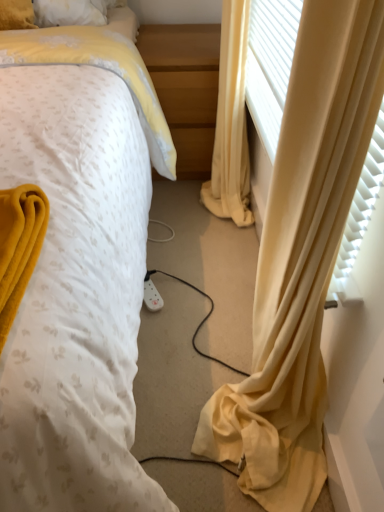
What do you see at coordinates (185, 88) in the screenshot?
I see `light wood/finely finished nightstand at center` at bounding box center [185, 88].

Where is `yellow fabric curtain at right`? This screenshot has width=384, height=512. yellow fabric curtain at right is located at coordinates click(x=231, y=122).

Is yellow fabric curtain at right to the right of white dotted fabric at center from the viewer's perspective?

Yes.

Can you confirm if yellow fabric curtain at right is taller than white dotted fabric at center?

Incorrect, the height of yellow fabric curtain at right is not larger of that of white dotted fabric at center.

Is yellow fabric curtain at right not inside white dotted fabric at center?

Indeed, yellow fabric curtain at right is completely outside white dotted fabric at center.

Locate an element on the screen. The height and width of the screenshot is (512, 384). bed on the left of yellow fabric curtain at right is located at coordinates (123, 22).

Considering their positions, is white dotted fabric at center located in front of or behind yellow fabric curtain at right?

Visually, white dotted fabric at center is located in front of yellow fabric curtain at right.

From a real-world perspective, which is physically below, white dotted fabric at center or yellow fabric curtain at right?

yellow fabric curtain at right, from a real-world perspective.

Would you say white dotted fabric at center is inside or outside yellow fabric curtain at right?

white dotted fabric at center exists outside the volume of yellow fabric curtain at right.

Between white dotted fabric at center and yellow fabric curtain at right, which one has larger size?

With larger size is white dotted fabric at center.

Is white dotted fabric at center outside of light wood/finely finished nightstand at center?

Yes, white dotted fabric at center is outside of light wood/finely finished nightstand at center.

From the image's perspective, would you say white dotted fabric at center is shown under light wood/finely finished nightstand at center?

Correct, white dotted fabric at center appears lower than light wood/finely finished nightstand at center in the image.

Is white dotted fabric at center taller or shorter than light wood/finely finished nightstand at center?

white dotted fabric at center is taller than light wood/finely finished nightstand at center.

Consider the image. Can you confirm if white dotted fabric at center is bigger than light wood/finely finished nightstand at center?

Correct, white dotted fabric at center is larger in size than light wood/finely finished nightstand at center.

Considering the positions of objects light wood/finely finished nightstand at center and white dotted fabric at center in the image provided, who is behind, light wood/finely finished nightstand at center or white dotted fabric at center?

light wood/finely finished nightstand at center is further from the camera.

The image size is (384, 512). What are the coordinates of `bed that is in front of the light wood/finely finished nightstand at center` in the screenshot? It's located at (123, 22).

Is point (210, 52) positioned behind point (122, 18)?

That is False.

Can you confirm if light wood/finely finished nightstand at center is positioned to the left of white dotted fabric at center?

In fact, light wood/finely finished nightstand at center is to the right of white dotted fabric at center.

In the image, is yellow fabric curtain at right positioned in front of or behind light wood/finely finished nightstand at center?

yellow fabric curtain at right is in front of light wood/finely finished nightstand at center.

Does yellow fabric curtain at right turn towards light wood/finely finished nightstand at center?

No.

From a real-world perspective, is yellow fabric curtain at right located beneath light wood/finely finished nightstand at center?

Incorrect, from a real-world perspective, yellow fabric curtain at right is higher than light wood/finely finished nightstand at center.

Is yellow fabric curtain at right at the right side of light wood/finely finished nightstand at center?

Yes, yellow fabric curtain at right is to the right of light wood/finely finished nightstand at center.

Are light wood/finely finished nightstand at center and yellow fabric curtain at right far apart?

No, light wood/finely finished nightstand at center is not far from yellow fabric curtain at right.

Considering the sizes of objects light wood/finely finished nightstand at center and yellow fabric curtain at right in the image provided, who is taller, light wood/finely finished nightstand at center or yellow fabric curtain at right?

With more height is yellow fabric curtain at right.

Can you tell me how much light wood/finely finished nightstand at center and yellow fabric curtain at right differ in facing direction?

There is a 90-degree angle between the facing directions of light wood/finely finished nightstand at center and yellow fabric curtain at right.

Is light wood/finely finished nightstand at center located outside yellow fabric curtain at right?

That's correct, light wood/finely finished nightstand at center is outside of yellow fabric curtain at right.

At what (x,y) coordinates should I click in order to perform the action: click on bed above the yellow fabric curtain at right (from a real-world perspective). Please return your answer as a coordinate pair (x, y). This screenshot has height=512, width=384. Looking at the image, I should click on (123, 22).

You are a GUI agent. You are given a task and a screenshot of the screen. Output one action in this format:
    pyautogui.click(x=<x>, y=<y>)
    Task: Click on the curtain located underneath the white dotted fabric at center (from a real-world perspective)
    
    Given the screenshot: What is the action you would take?
    pyautogui.click(x=231, y=122)

Estimate the real-world distances between objects in this image. Which object is closer to yellow fabric curtain at right, white dotted fabric at center or light wood/finely finished nightstand at center?

light wood/finely finished nightstand at center.

Considering their positions, is light wood/finely finished nightstand at center positioned further to white dotted fabric at center than yellow fabric curtain at right?

Based on the image, light wood/finely finished nightstand at center appears to be further to white dotted fabric at center.

Estimate the real-world distances between objects in this image. Which object is closer to yellow fabric curtain at right, light wood/finely finished nightstand at center or white dotted fabric at center?

light wood/finely finished nightstand at center is positioned closer to the anchor yellow fabric curtain at right.

When comparing their distances from light wood/finely finished nightstand at center, does yellow fabric curtain at right or white dotted fabric at center seem closer?

The object closer to light wood/finely finished nightstand at center is yellow fabric curtain at right.

From the image, which object appears to be farther from white dotted fabric at center, yellow fabric curtain at right or light wood/finely finished nightstand at center?

Among the two, light wood/finely finished nightstand at center is located further to white dotted fabric at center.

From the picture: Based on their spatial positions, is white dotted fabric at center or yellow fabric curtain at right further from light wood/finely finished nightstand at center?

white dotted fabric at center is further to light wood/finely finished nightstand at center.

This screenshot has width=384, height=512. In order to click on curtain between white dotted fabric at center and light wood/finely finished nightstand at center from front to back in this screenshot , I will do click(x=231, y=122).